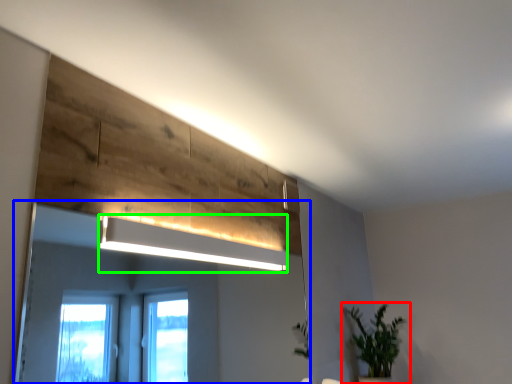
Question: Which is nearer to the houseplant (highlighted by a red box)? mirror (highlighted by a blue box) or lamp (highlighted by a green box).

Choices:
 (A) mirror
 (B) lamp

Answer: (B)